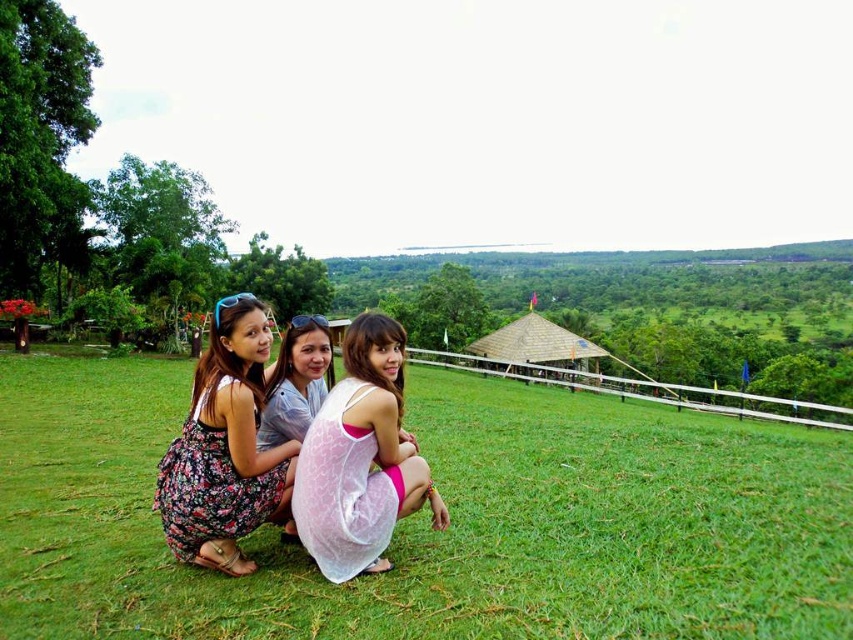
Consider the image. Is green grass at center to the right of floral fabric dress at lower left from the viewer's perspective?

Incorrect, green grass at center is not on the right side of floral fabric dress at lower left.

Is green grass at center behind floral fabric dress at lower left?

No, green grass at center is in front of floral fabric dress at lower left.

Identify the location of green grass at center. Image resolution: width=853 pixels, height=640 pixels. (428, 522).

Based on the photo, between white lace dress at center and floral dress at center, which one has less height?

With less height is floral dress at center.

From the picture: Does white lace dress at center have a greater height compared to floral dress at center?

Yes, white lace dress at center is taller than floral dress at center.

The image size is (853, 640). Describe the element at coordinates (360, 458) in the screenshot. I see `white lace dress at center` at that location.

The image size is (853, 640). I want to click on white lace dress at center, so click(360, 458).

From the picture: Who is more forward, (154, 499) or (265, 429)?

Positioned in front is point (265, 429).

Is floral fabric dress at lower left smaller than floral dress at center?

Incorrect, floral fabric dress at lower left is not smaller in size than floral dress at center.

In order to click on floral fabric dress at lower left in this screenshot , I will do `click(212, 488)`.

You are a GUI agent. You are given a task and a screenshot of the screen. Output one action in this format:
    pyautogui.click(x=<x>, y=<y>)
    Task: Click on the floral fabric dress at lower left
    
    Given the screenshot: What is the action you would take?
    pyautogui.click(x=212, y=488)